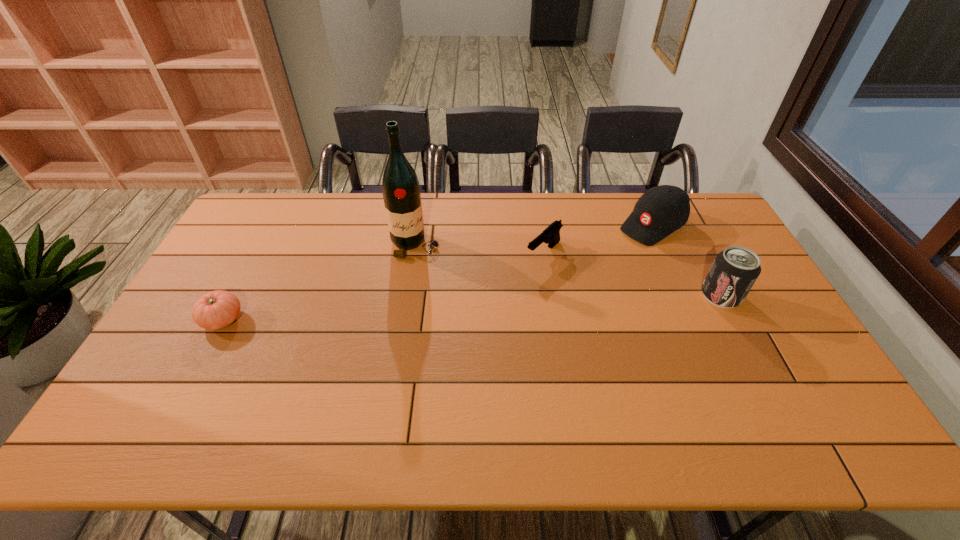
At what (x,y) coordinates should I click in order to perform the action: click on free space on the desktop that is between the tomato and the soda can and is positioned on the front-facing side of the pistol. Please return your answer as a coordinate pair (x, y). The image size is (960, 540). Looking at the image, I should click on (482, 307).

The height and width of the screenshot is (540, 960). Identify the location of free space on the desktop that is between the tomato and the soda can and is positioned on the surface of the second object from left to right. (444, 309).

This screenshot has height=540, width=960. I want to click on free spot on the desktop that is between the tomato and the soda can and is positioned with a logo on the front of the third tallest object, so click(531, 305).